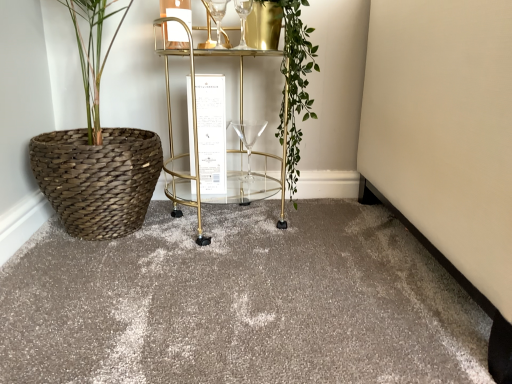
Question: Do you think green leafy plant at center is within matte gray carpet at center, or outside of it?

Choices:
 (A) outside
 (B) inside

Answer: (A)

Question: Looking at the image, does green leafy plant at center seem bigger or smaller compared to matte gray carpet at center?

Choices:
 (A) big
 (B) small

Answer: (B)

Question: Estimate the real-world distances between objects in this image. Which object is farther from the matte gray carpet at center?

Choices:
 (A) clear glass wine glass at upper center, marked as the 1th wine glass in a front-to-back arrangement
 (B) green leafy plant at center
 (C) gold metallic bar cart at center
 (D) transparent glass wine glass at center, arranged as the 2th wine glass when viewed from the top

Answer: (A)

Question: Which is farther from the clear glass wine glass at upper center, the first wine glass positioned from the top?

Choices:
 (A) gold metallic bar cart at center
 (B) matte gray carpet at center
 (C) transparent glass wine glass at center, which appears as the first wine glass when ordered from the bottom
 (D) green leafy plant at center

Answer: (B)